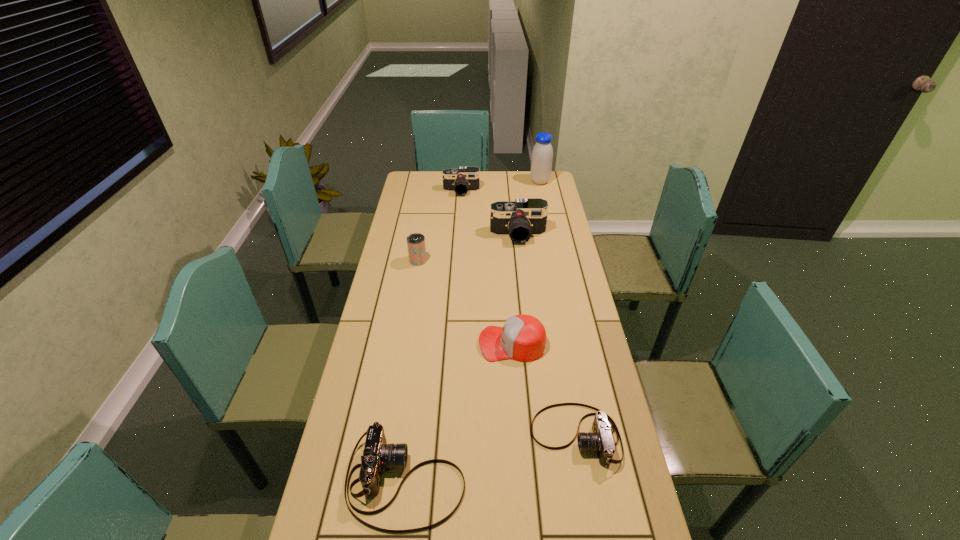
Locate an element on the screen. object that is at the far right corner is located at coordinates (542, 155).

This screenshot has height=540, width=960. What are the coordinates of `vacant space at the far edge of the desktop` in the screenshot? It's located at (500, 192).

This screenshot has height=540, width=960. Identify the location of vacant space at the left edge of the desktop. point(343,438).

Find the location of a particular element. The width and height of the screenshot is (960, 540). vacant space at the right edge is located at coordinates (x=558, y=252).

Locate an element on the screen. vacant space at the far left corner is located at coordinates (405, 177).

This screenshot has height=540, width=960. Find the location of `vacant region at the far right corner of the desktop`. vacant region at the far right corner of the desktop is located at coordinates (548, 192).

Locate an element on the screen. This screenshot has width=960, height=540. empty space that is in between the third nearest object and the tallest object is located at coordinates (526, 262).

You are a GUI agent. You are given a task and a screenshot of the screen. Output one action in this format:
    pyautogui.click(x=<x>, y=<y>)
    Task: Click on the vacant area between the tallest camera and the baseball cap
    This screenshot has height=540, width=960.
    Given the screenshot: What is the action you would take?
    pyautogui.click(x=516, y=289)

This screenshot has width=960, height=540. In order to click on unoccupied area between the blue soya milk and the beer can in this screenshot , I will do `click(479, 221)`.

In order to click on unoccupied position between the shortest camera and the bigger brown camera in this screenshot , I will do `click(491, 458)`.